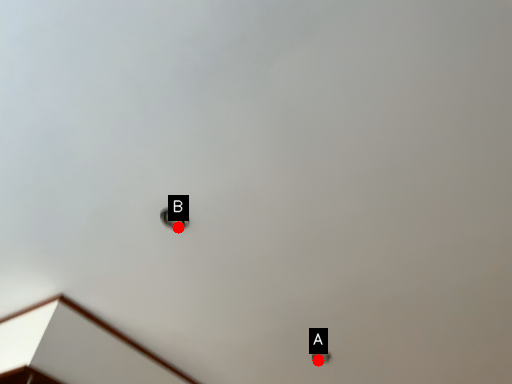
Question: Two points are circled on the image, labeled by A and B beside each circle. Which point appears farthest from the camera in this image?

Choices:
 (A) A is further
 (B) B is further

Answer: (A)